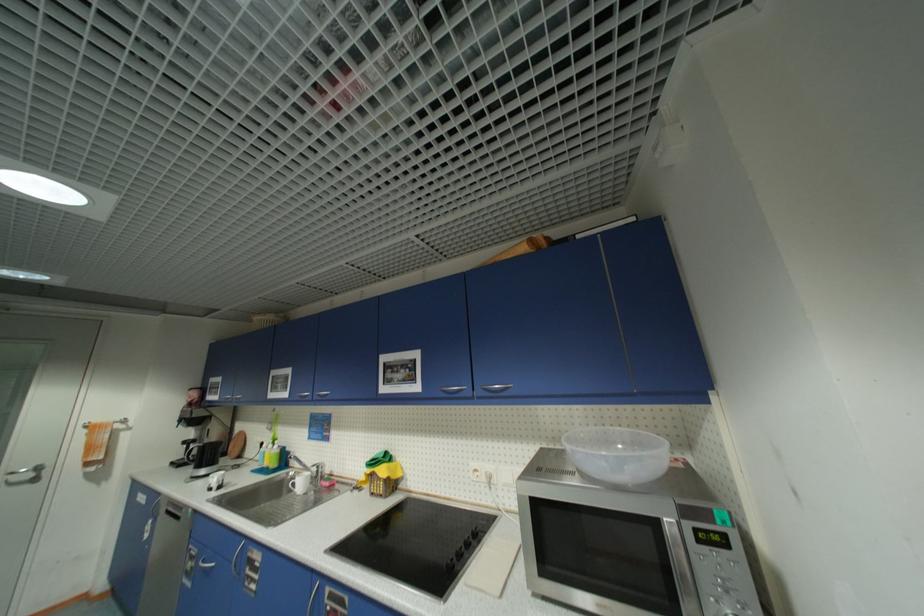
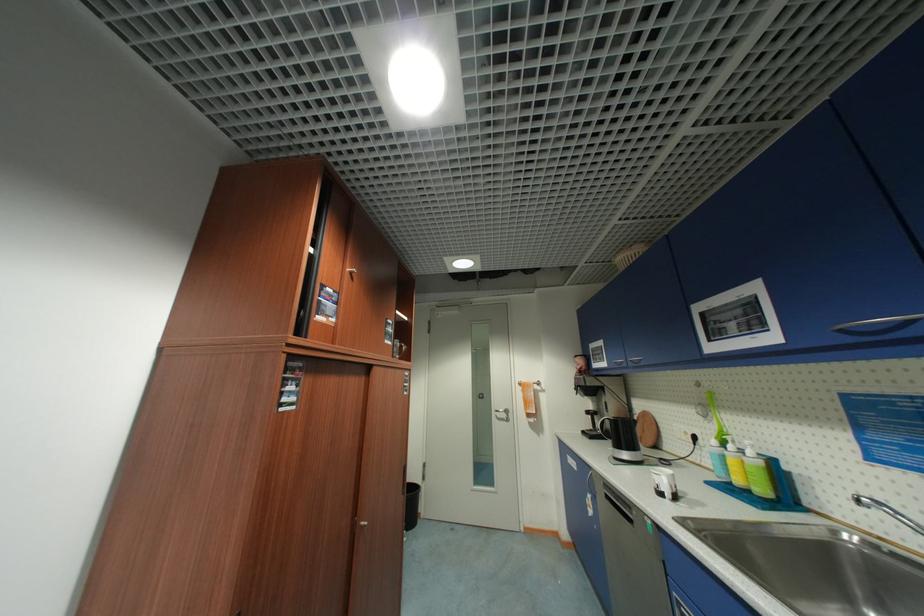
Where in the second image is the point corresponding to point (282, 448) from the first image?

(756, 454)